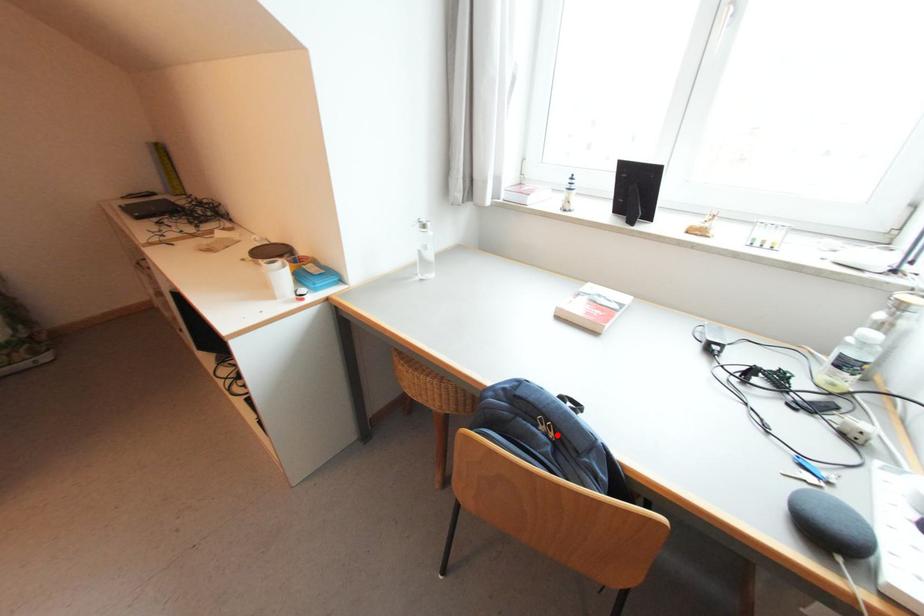
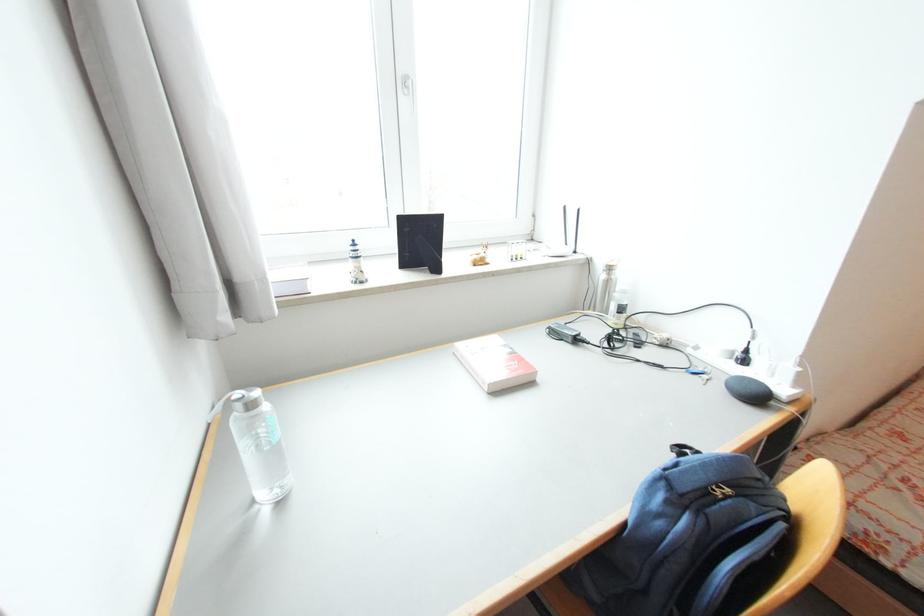
Locate, in the second image, the point that corresponds to the highlighted location in the first image.

(734, 492)